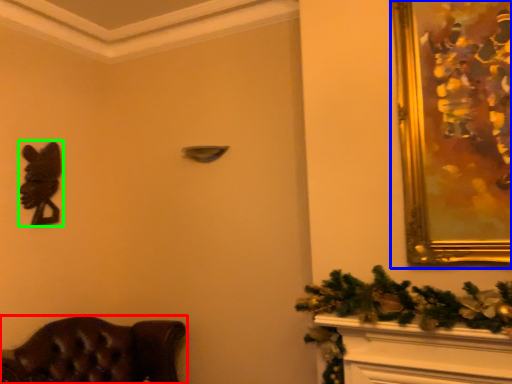
Question: Which object is positioned farthest from furniture (highlighted by a red box)? Select from picture frame (highlighted by a blue box) and animal (highlighted by a green box).

Choices:
 (A) picture frame
 (B) animal

Answer: (A)